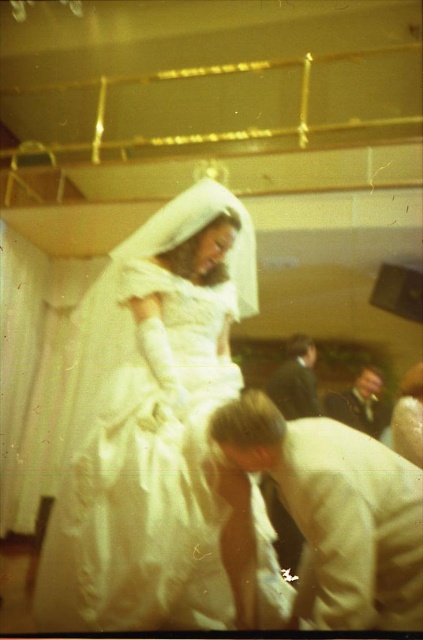
Which is more to the right, dark suit at center or dark brown leather jacket at lower right?

dark brown leather jacket at lower right

Is dark suit at center behind dark brown leather jacket at lower right?

Yes.

Between point (307, 403) and point (376, 433), which one is positioned behind?

The point (307, 403) is more distant.

You are a GUI agent. You are given a task and a screenshot of the screen. Output one action in this format:
    pyautogui.click(x=<x>, y=<y>)
    Task: Click on the dark suit at center
    
    Given the screenshot: What is the action you would take?
    pyautogui.click(x=296, y=380)

Does white satin suit at lower center have a greater height compared to dark brown leather jacket at lower right?

Yes.

Is white satin suit at lower center smaller than dark brown leather jacket at lower right?

Actually, white satin suit at lower center might be larger than dark brown leather jacket at lower right.

Is point (313, 620) closer to camera compared to point (326, 396)?

Yes, it is in front of point (326, 396).

Where is `white satin suit at lower center`? Image resolution: width=423 pixels, height=640 pixels. white satin suit at lower center is located at coordinates (337, 513).

What do you see at coordinates (159, 436) in the screenshot? The width and height of the screenshot is (423, 640). I see `white satin dress at center` at bounding box center [159, 436].

The image size is (423, 640). What do you see at coordinates (159, 436) in the screenshot?
I see `white satin dress at center` at bounding box center [159, 436].

I want to click on white satin dress at center, so click(x=159, y=436).